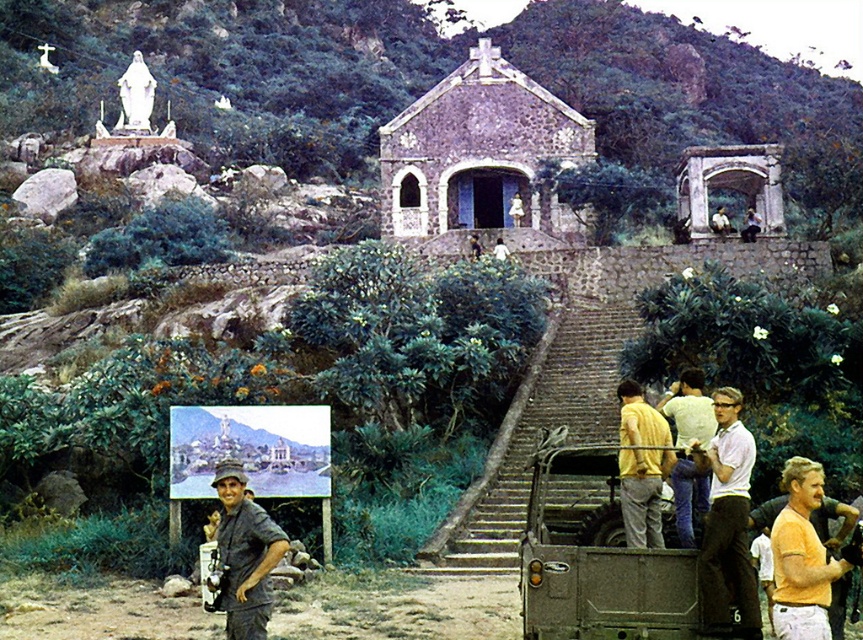
Question: Can you confirm if camouflage fabric truck at center is positioned above yellow matte shirt at lower right?

Choices:
 (A) no
 (B) yes

Answer: (A)

Question: Where is stone textured church at center located in relation to yellow shirt at center in the image?

Choices:
 (A) below
 (B) above

Answer: (B)

Question: Which of these objects is positioned farthest from the white matte shirt at center right?

Choices:
 (A) stone textured church at center
 (B) yellow shirt at center

Answer: (A)

Question: Which of the following is the closest to the observer?

Choices:
 (A) (710, 604)
 (B) (483, 218)
 (C) (662, 451)
 (D) (265, 540)

Answer: (A)

Question: Which point is farther to the camera?

Choices:
 (A) (249, 566)
 (B) (802, 627)
 (C) (657, 468)

Answer: (C)

Question: Is the position of stone textured church at center less distant than that of yellow matte pickup truck at lower right?

Choices:
 (A) yes
 (B) no

Answer: (B)